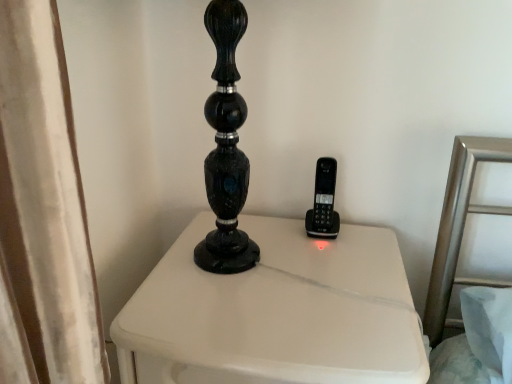
Question: Should I look upward or downward to see black plastic phone at center?

Choices:
 (A) down
 (B) up

Answer: (A)

Question: From the image's perspective, is white painted wood nightstand at center beneath black plastic phone at center?

Choices:
 (A) yes
 (B) no

Answer: (A)

Question: Is white painted wood nightstand at center outside black plastic phone at center?

Choices:
 (A) no
 (B) yes

Answer: (B)

Question: Does white painted wood nightstand at center have a greater height compared to black plastic phone at center?

Choices:
 (A) no
 (B) yes

Answer: (B)

Question: Is white painted wood nightstand at center in front of black plastic phone at center?

Choices:
 (A) no
 (B) yes

Answer: (B)

Question: Is white painted wood nightstand at center bigger than black plastic phone at center?

Choices:
 (A) yes
 (B) no

Answer: (A)

Question: Does white painted wood nightstand at center have a smaller size compared to black plastic phone at center?

Choices:
 (A) no
 (B) yes

Answer: (A)

Question: Can you confirm if black plastic phone at center is positioned to the right of white painted wood nightstand at center?

Choices:
 (A) no
 (B) yes

Answer: (B)

Question: Is black plastic phone at center placed right next to white painted wood nightstand at center?

Choices:
 (A) no
 (B) yes

Answer: (A)

Question: Can you confirm if black plastic phone at center is positioned to the left of white painted wood nightstand at center?

Choices:
 (A) yes
 (B) no

Answer: (B)

Question: Does black plastic phone at center have a lesser height compared to white painted wood nightstand at center?

Choices:
 (A) yes
 (B) no

Answer: (A)

Question: Is white painted wood nightstand at center surrounded by black plastic phone at center?

Choices:
 (A) yes
 (B) no

Answer: (B)

Question: From a real-world perspective, does black plastic phone at center sit lower than white painted wood nightstand at center?

Choices:
 (A) yes
 (B) no

Answer: (B)

Question: From the image's perspective, is black plastic phone at center positioned above or below white painted wood nightstand at center?

Choices:
 (A) above
 (B) below

Answer: (A)